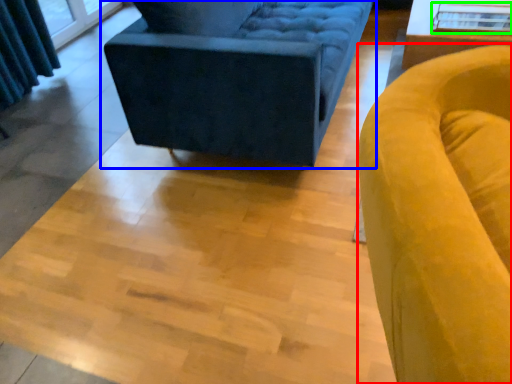
Question: Based on their relative distances, which object is farther from chair (highlighted by a red box)? Choose from studio couch (highlighted by a blue box) and glass table (highlighted by a green box).

Choices:
 (A) studio couch
 (B) glass table

Answer: (B)